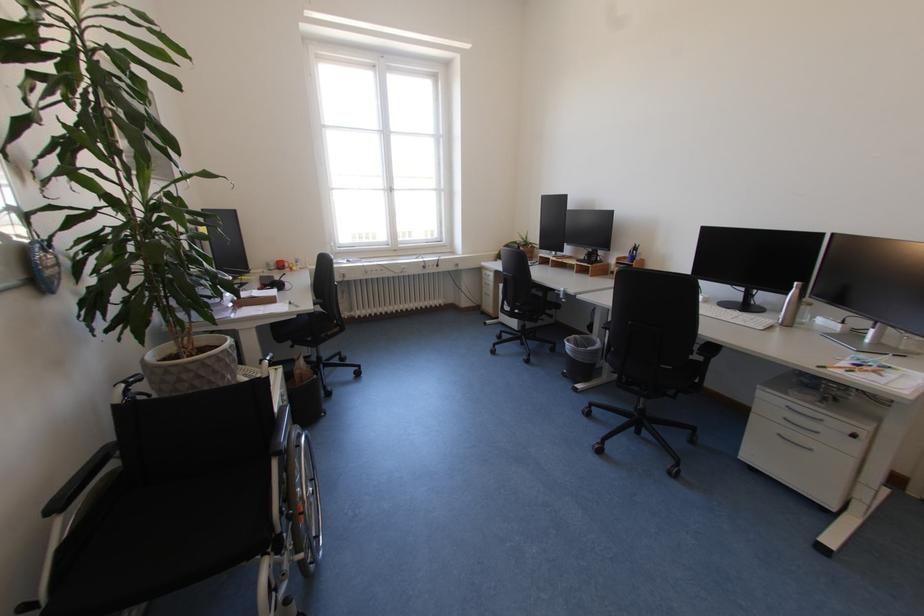
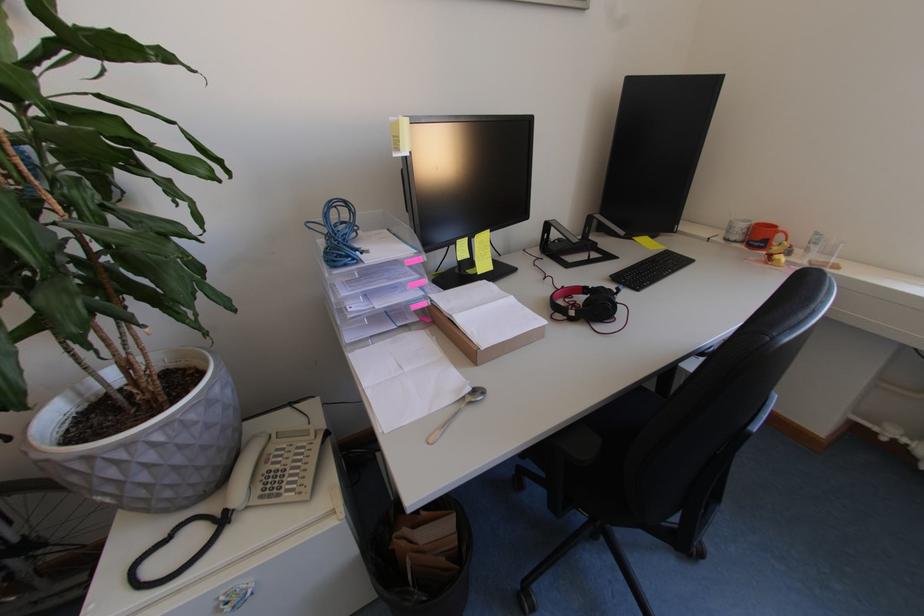
In the second image, find the point that corresponds to point 306,265 in the first image.

(816, 253)